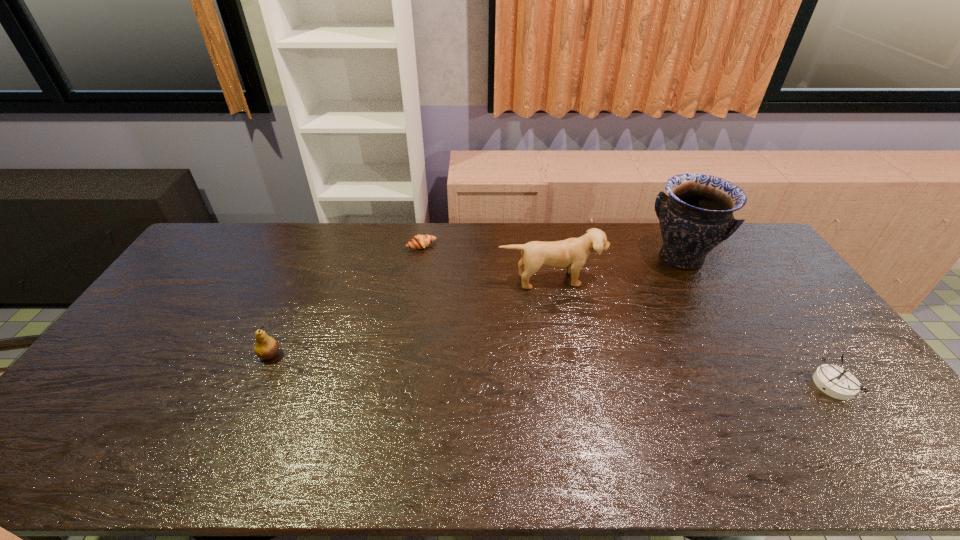
Image resolution: width=960 pixels, height=540 pixels. Find the location of `vacant point that satisfies the following two spatial constraints: 1. on the back side of the third shortest object; 2. on the left side of the third object from right to left`. vacant point that satisfies the following two spatial constraints: 1. on the back side of the third shortest object; 2. on the left side of the third object from right to left is located at coordinates (304, 279).